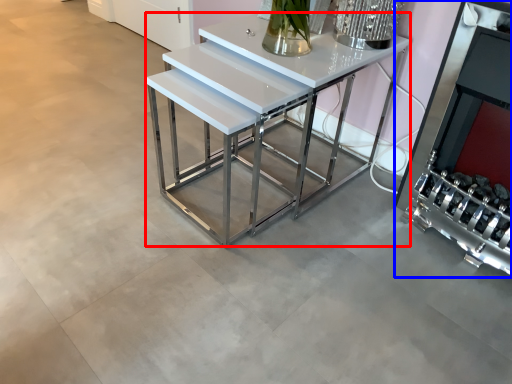
Question: Which object is closer to the camera taking this photo, table (highlighted by a red box) or fireplace (highlighted by a blue box)?

Choices:
 (A) table
 (B) fireplace

Answer: (B)